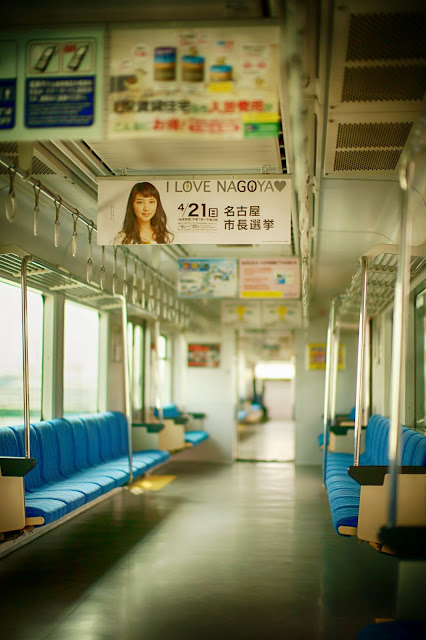
I want to click on under left seats, so click(x=76, y=523).